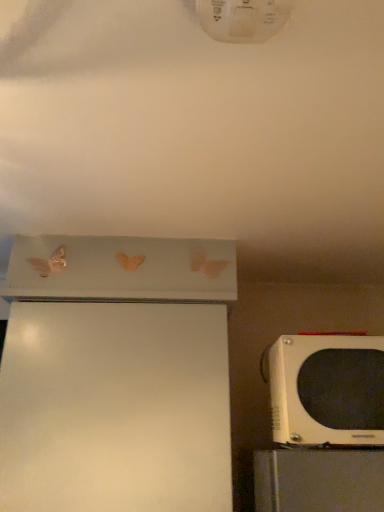
Locate an element on the screen. The height and width of the screenshot is (512, 384). white matte microwave at right is located at coordinates point(327,390).

This screenshot has height=512, width=384. Describe the element at coordinates (327, 390) in the screenshot. I see `white matte microwave at right` at that location.

In order to click on white matte microwave at right in this screenshot , I will do `click(327, 390)`.